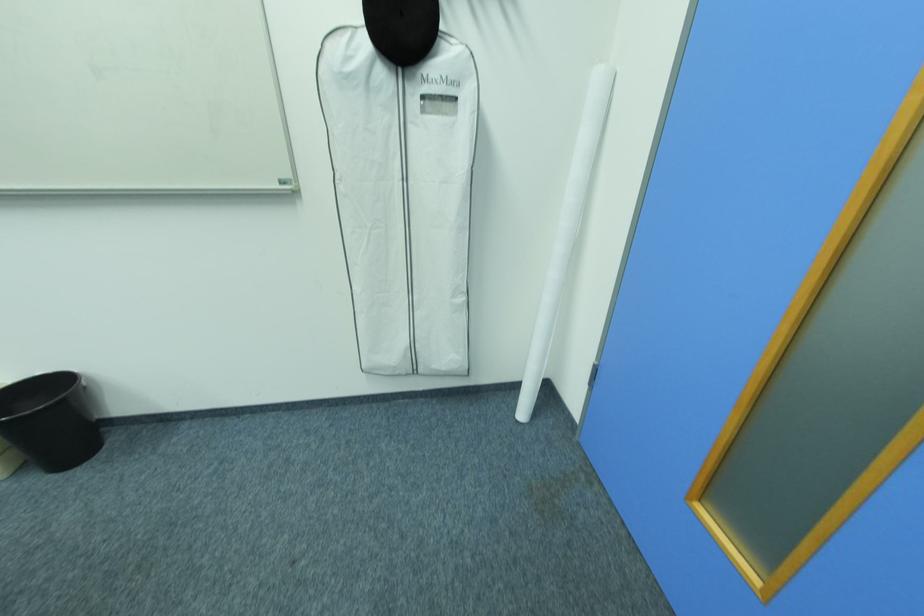
The image size is (924, 616). I want to click on black hat, so click(x=402, y=28).